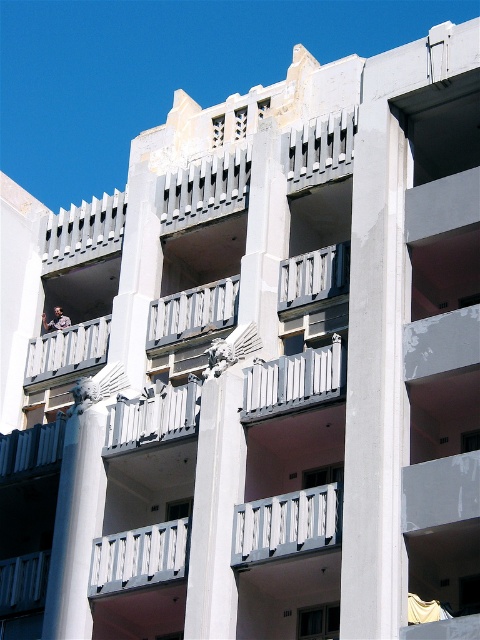
You are an architect examining the building facade. You notice the white concrete pillar at center and the white smooth column at center. Which one is located above the other?

The white concrete pillar at center is positioned over the white smooth column at center, meaning it is above it.

You are an architect designing a new balcony extension for the building. You need to ensure that the distance between the white concrete pillar at center and the white matte balustrade at center meets safety regulations, which require a minimum of 10 meters. Is the current distance compliant?

The white concrete pillar at center and white matte balustrade at center are 9.16 meters apart, which is less than the required 10 meters. Therefore, the current distance does not comply with safety regulations.

You are an architect examining the building facade. You notice the white smooth column at center and the white painted wood at center. Which object is closer to you when standing directly in front of the building?

The white smooth column at center is closer to you because it is in front of the white painted wood at center.